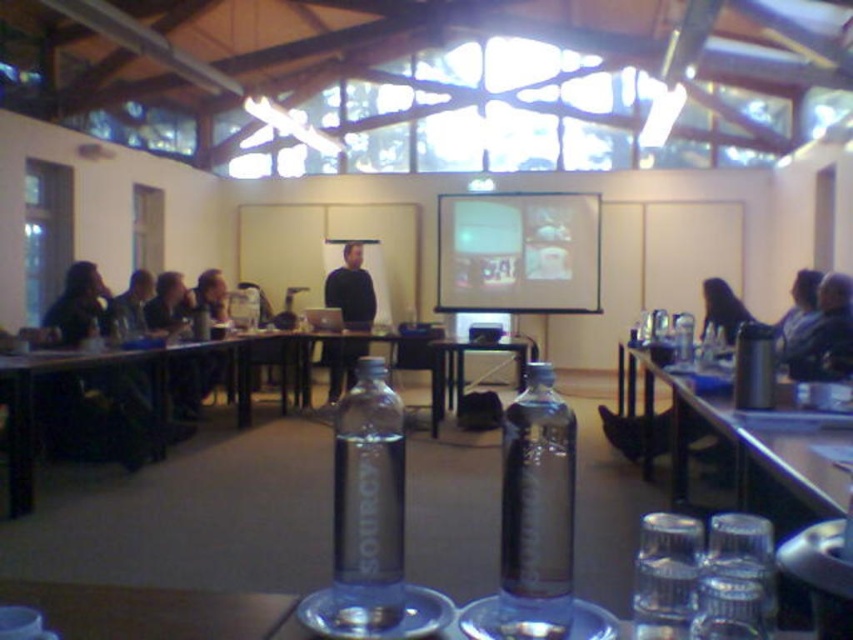
Is transparent glass bottle at center wider than dark brown leather chair at right?

No, transparent glass bottle at center is not wider than dark brown leather chair at right.

Does transparent glass bottle at center lie in front of dark brown leather chair at right?

Yes, transparent glass bottle at center is closer to the viewer.

Between point (502, 582) and point (728, 305), which one is positioned in front?

Point (502, 582) is in front.

Find the location of a particular element. The image size is (853, 640). transparent glass bottle at center is located at coordinates (537, 509).

Is transparent plastic bottle at lower right smaller than dark hair at left?

Correct, transparent plastic bottle at lower right occupies less space than dark hair at left.

Who is more forward, (675, 513) or (132, 296)?

Point (675, 513) is in front.

Find the location of a particular element. transparent plastic bottle at lower right is located at coordinates (x=665, y=576).

Which is above, transparent plastic bottle at center or blue fabric jacket at right?

Positioned higher is blue fabric jacket at right.

Who is more distant from viewer, (x=367, y=600) or (x=843, y=362)?

Point (x=843, y=362)

Locate an element on the screen. This screenshot has height=640, width=853. transparent plastic bottle at center is located at coordinates (368, 500).